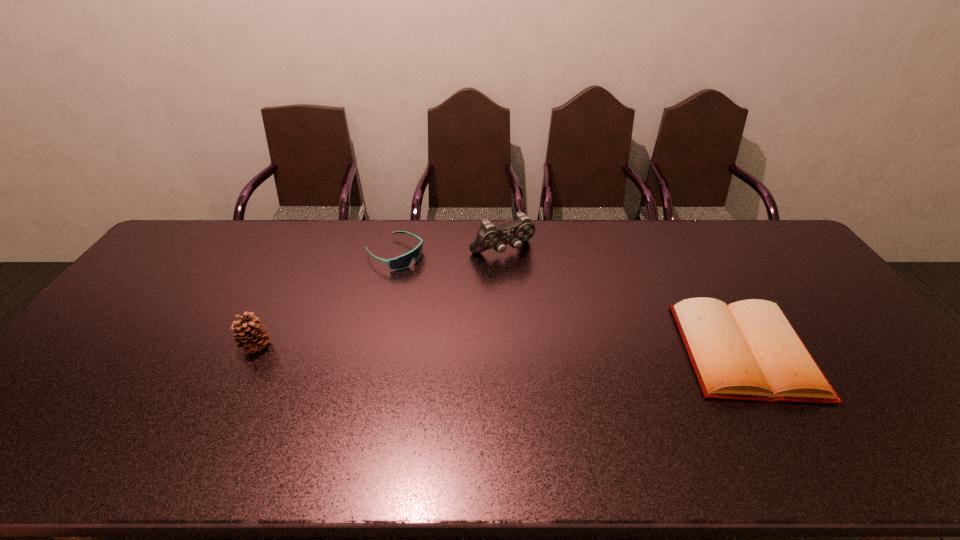
Where is `free point between the third object from left to right and the leftmost object`? The image size is (960, 540). free point between the third object from left to right and the leftmost object is located at coordinates (379, 299).

This screenshot has height=540, width=960. Identify the location of free spot between the leftmost object and the third object from left to right. (379, 299).

Image resolution: width=960 pixels, height=540 pixels. What are the coordinates of `object that is the third closest to the second shortest object` in the screenshot? It's located at (748, 350).

Find the location of `object that is the second closest one to the third object from left to right`. object that is the second closest one to the third object from left to right is located at coordinates (748, 350).

The height and width of the screenshot is (540, 960). Find the location of `vacant space that satisfies the following two spatial constraints: 1. on the back side of the second shortest object; 2. on the left side of the leftmost object`. vacant space that satisfies the following two spatial constraints: 1. on the back side of the second shortest object; 2. on the left side of the leftmost object is located at coordinates (301, 254).

I want to click on free spot that satisfies the following two spatial constraints: 1. on the front side of the leftmost object; 2. on the left side of the shortest object, so click(254, 350).